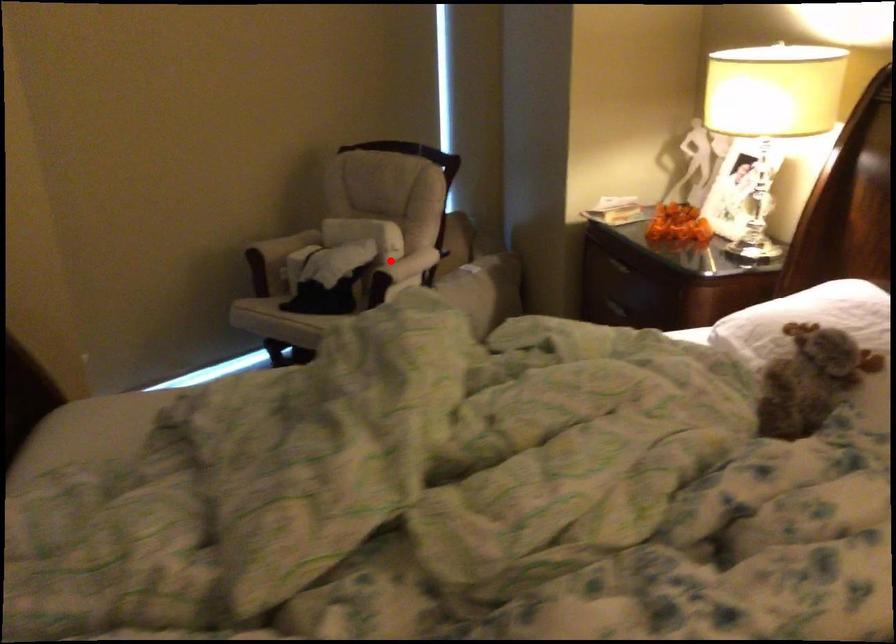
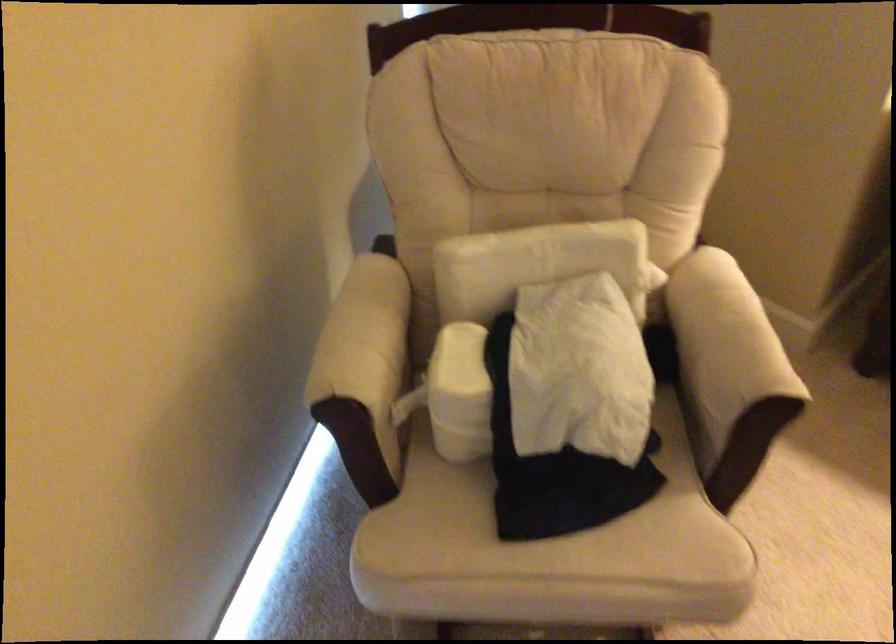
Question: A red point is marked in image1. In image2, is the corresponding 3D point closer to the camera or farther? Reply with the corresponding letter.

Choices:
 (A) The corresponding 3D point is closer.
 (B) The corresponding 3D point is farther.

Answer: (A)